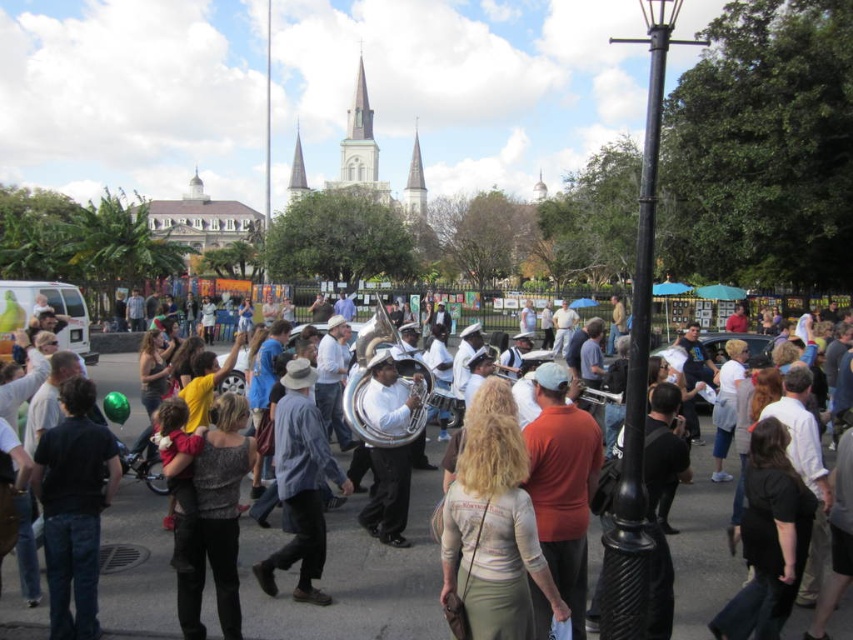
Based on the photo, you are a photographer standing at the center of the street, wanting to capture both the brass band and the church spire in your photo. You notice two points marked in the scene. Which point is closer to your camera? The points are point (x=374, y=540) and point (x=306, y=493).

Point (x=306, y=493) is closer to the camera because it is less further than point (x=374, y=540).